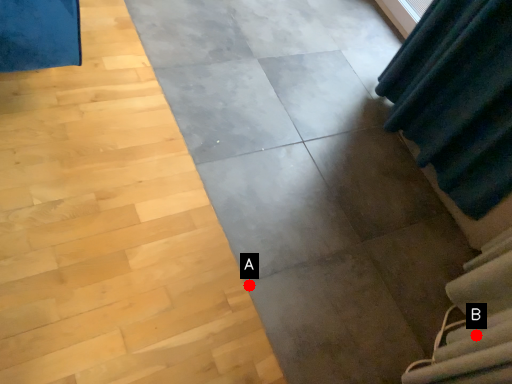
Question: Two points are circled on the image, labeled by A and B beside each circle. Which point is closer to the camera?

Choices:
 (A) A is closer
 (B) B is closer

Answer: (B)